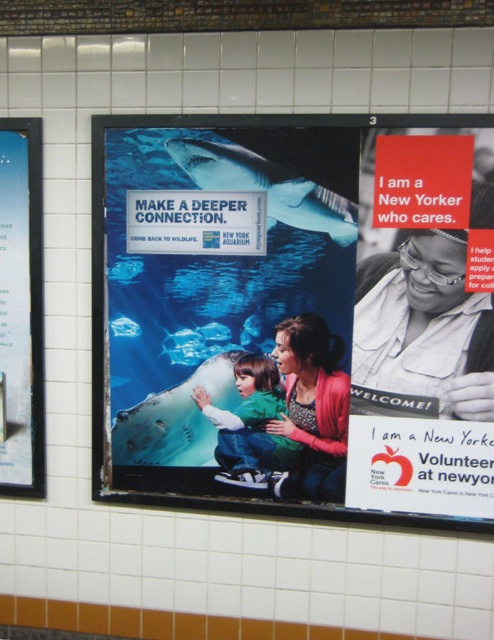
Question: Is matte blue poster at center thinner than white shirt at upper right?

Choices:
 (A) no
 (B) yes

Answer: (A)

Question: Can you confirm if matte glass window at left is thinner than green cotton shirt at center?

Choices:
 (A) no
 (B) yes

Answer: (B)

Question: Which point appears closest to the camera in this image?

Choices:
 (A) (429, 394)
 (B) (127, 448)
 (C) (275, 477)
 (D) (15, 166)

Answer: (A)

Question: Which of the following is the farthest from the observer?

Choices:
 (A) (258, 356)
 (B) (417, 392)

Answer: (A)

Question: Is matte blue poster at center wider than matte glass window at left?

Choices:
 (A) yes
 (B) no

Answer: (A)

Question: Which object is closer to the camera taking this photo?

Choices:
 (A) matte blue poster at center
 (B) matte glass window at left
 (C) green cotton shirt at center

Answer: (A)